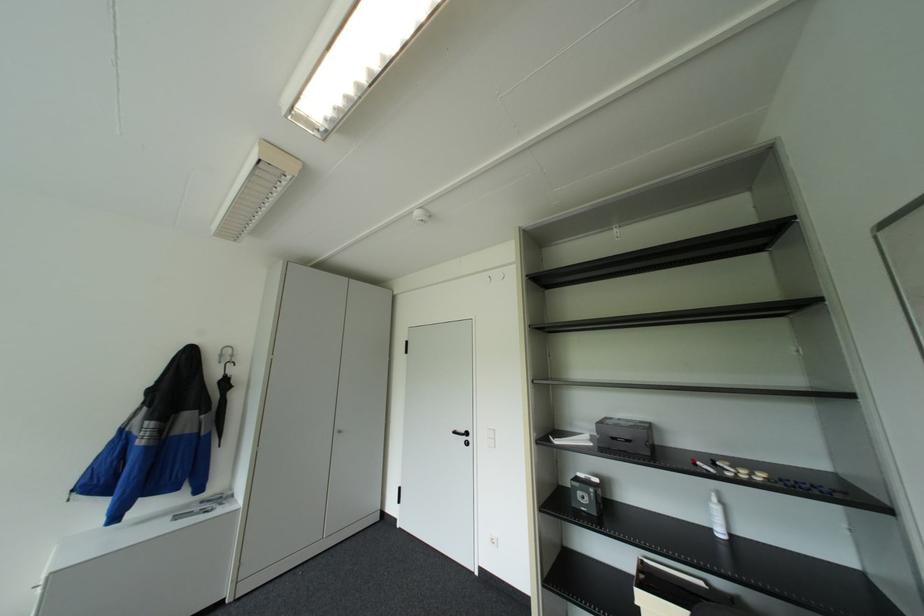
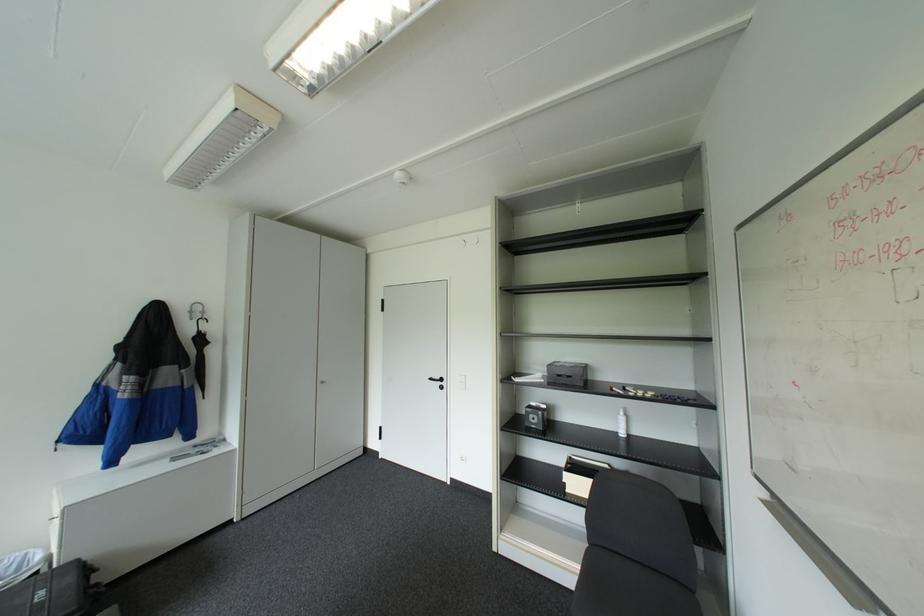
In the second image, find the point that corresponds to (x=591, y=496) in the first image.

(541, 416)